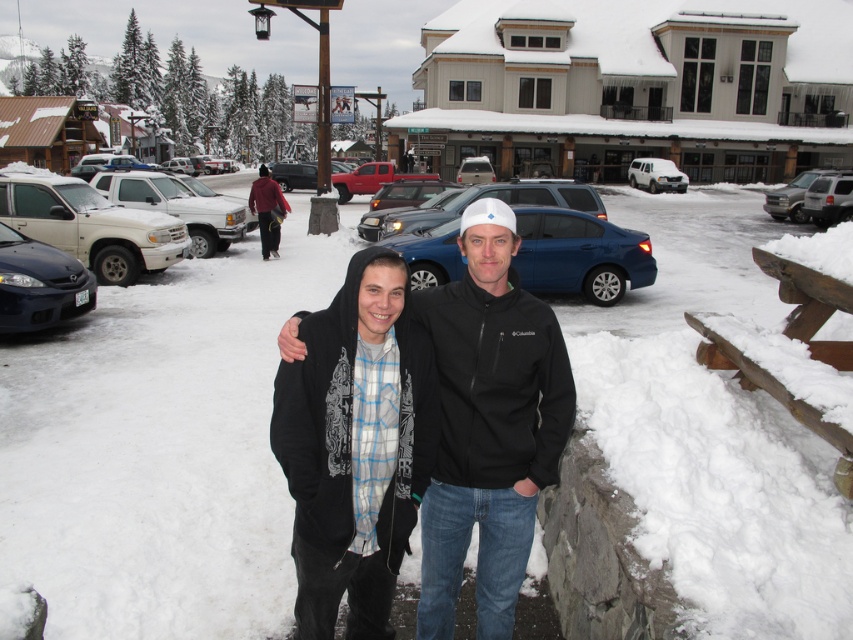
From the picture: Does black softshell jacket at center have a lesser width compared to matte white truck at left?

Yes.

Between black softshell jacket at center and matte white truck at left, which one appears on the left side from the viewer's perspective?

Positioned to the left is matte white truck at left.

Where is `black softshell jacket at center`? black softshell jacket at center is located at coordinates (489, 422).

Where is `black softshell jacket at center`? The height and width of the screenshot is (640, 853). black softshell jacket at center is located at coordinates (489, 422).

Which of these two, silver metallic truck at right or white matte van at upper right, stands shorter?

white matte van at upper right

Can you confirm if silver metallic truck at right is positioned above white matte van at upper right?

No.

This screenshot has height=640, width=853. I want to click on silver metallic truck at right, so click(795, 195).

Where is `silver metallic truck at right`? silver metallic truck at right is located at coordinates (795, 195).

Does white matte truck at center have a lesser height compared to silver metallic suv at center?

Correct, white matte truck at center is not as tall as silver metallic suv at center.

Which is in front, point (219, 234) or point (808, 209)?

Positioned in front is point (219, 234).

You are a GUI agent. You are given a task and a screenshot of the screen. Output one action in this format:
    pyautogui.click(x=<x>, y=<y>)
    Task: Click on the white matte truck at center
    The width and height of the screenshot is (853, 640).
    Given the screenshot: What is the action you would take?
    pyautogui.click(x=177, y=205)